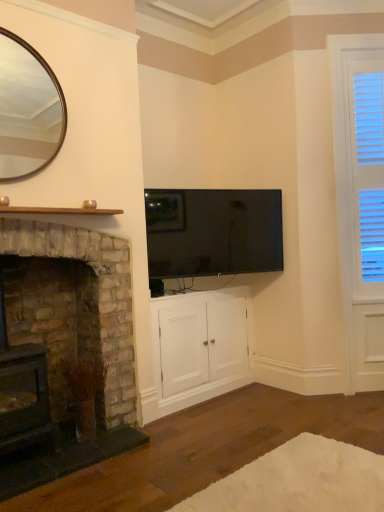
Question: Could gold-framed mirror at upper left be considered to be inside white fluffy rug at lower center?

Choices:
 (A) no
 (B) yes

Answer: (A)

Question: Is white fluffy rug at lower center directly adjacent to gold-framed mirror at upper left?

Choices:
 (A) no
 (B) yes

Answer: (A)

Question: Does white fluffy rug at lower center have a lesser width compared to gold-framed mirror at upper left?

Choices:
 (A) yes
 (B) no

Answer: (B)

Question: From a real-world perspective, is white fluffy rug at lower center located higher than gold-framed mirror at upper left?

Choices:
 (A) yes
 (B) no

Answer: (B)

Question: Is white fluffy rug at lower center positioned in front of gold-framed mirror at upper left?

Choices:
 (A) no
 (B) yes

Answer: (B)

Question: From the image's perspective, is white fluffy rug at lower center on top of gold-framed mirror at upper left?

Choices:
 (A) no
 (B) yes

Answer: (A)

Question: Is rustic stone fireplace at left, which is counted as the 2th fireplace, starting from the left, at the right side of flat-screen black tv at upper center?

Choices:
 (A) yes
 (B) no

Answer: (B)

Question: Is rustic stone fireplace at left, which is counted as the 2th fireplace, starting from the left, oriented towards flat-screen black tv at upper center?

Choices:
 (A) yes
 (B) no

Answer: (B)

Question: From a real-world perspective, is rustic stone fireplace at left, the 1th fireplace positioned from the right, below flat-screen black tv at upper center?

Choices:
 (A) no
 (B) yes

Answer: (B)

Question: Is rustic stone fireplace at left, the 1th fireplace positioned from the right, far away from flat-screen black tv at upper center?

Choices:
 (A) no
 (B) yes

Answer: (A)

Question: From a real-world perspective, is rustic stone fireplace at left, the 1th fireplace positioned from the right, positioned over flat-screen black tv at upper center based on gravity?

Choices:
 (A) no
 (B) yes

Answer: (A)

Question: Is rustic stone fireplace at left, the 1th fireplace positioned from the right, smaller than flat-screen black tv at upper center?

Choices:
 (A) yes
 (B) no

Answer: (B)

Question: Is flat-screen black tv at upper center at the right side of rustic stone fireplace at left, which is counted as the 2th fireplace, starting from the left?

Choices:
 (A) yes
 (B) no

Answer: (A)